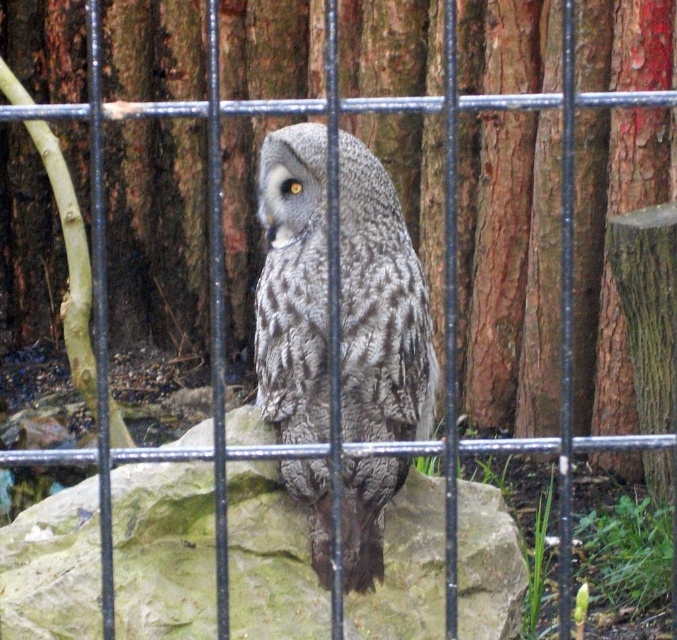
Which is more to the right, gray rough stone at center or gray textured owl at center?

From the viewer's perspective, gray textured owl at center appears more on the right side.

Is point (410, 509) in front of point (416, 323)?

That is False.

The height and width of the screenshot is (640, 677). Identify the location of gray rough stone at center. (162, 550).